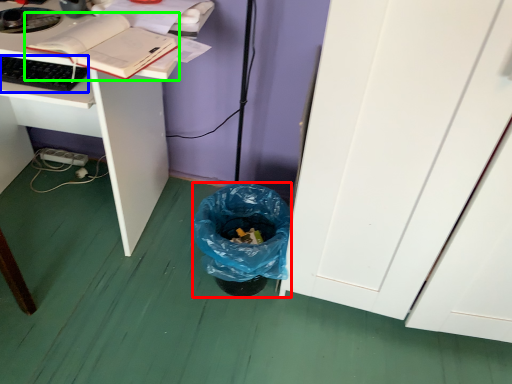
Question: Which object is the closest to the trash bin/can (highlighted by a red box)? Choose among these: computer keyboard (highlighted by a blue box) or book (highlighted by a green box).

Choices:
 (A) computer keyboard
 (B) book

Answer: (B)